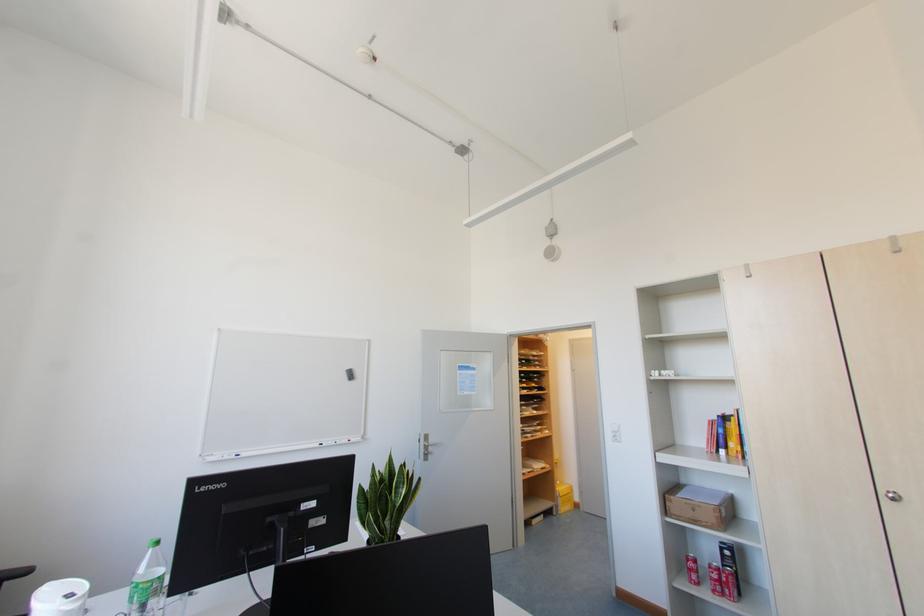
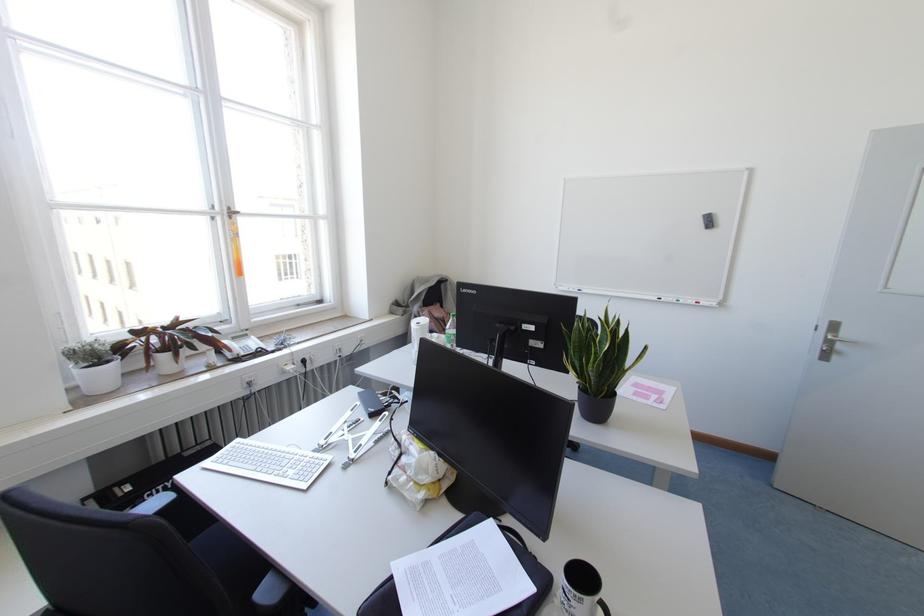
Locate, in the second image, the point that corresponds to pixel 428 442 in the first image.

(834, 336)